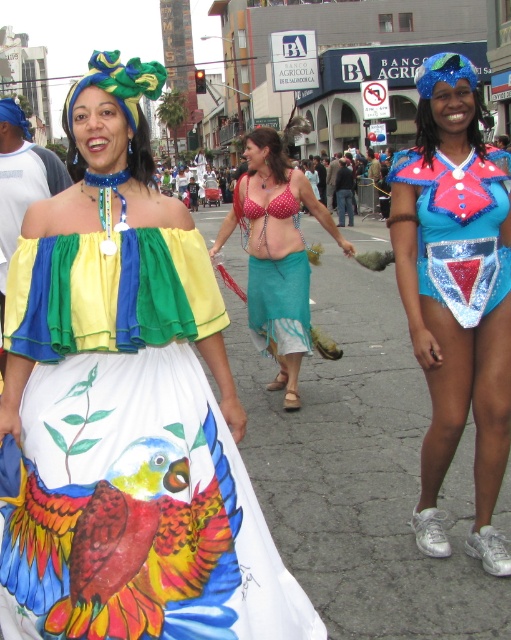
Question: Which object is closer to the camera taking this photo?

Choices:
 (A) vivid painted parrot at lower left
 (B) blue sequined top at right
 (C) painted cotton skirt at center

Answer: (C)

Question: Is painted cotton skirt at center to the right of polka dot fabric bikini top at center from the viewer's perspective?

Choices:
 (A) no
 (B) yes

Answer: (A)

Question: Is painted cotton skirt at center above polka dot fabric bikini top at center?

Choices:
 (A) yes
 (B) no

Answer: (B)

Question: Which of the following is the farthest from the observer?

Choices:
 (A) polka dot fabric bikini top at center
 (B) blue sequined leotard at center
 (C) painted cotton skirt at center
 (D) teal fabric skirt at center

Answer: (A)

Question: Which of the following is the closest to the observer?

Choices:
 (A) (464, 248)
 (B) (296, 275)

Answer: (A)

Question: Does painted cotton skirt at center appear under teal fabric skirt at center?

Choices:
 (A) yes
 (B) no

Answer: (A)